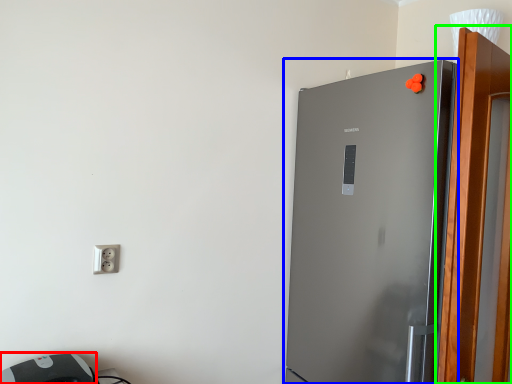
Question: Estimate the real-world distances between objects in this image. Which object is closer to appliance (highlighted by a red box), refrigerator (highlighted by a blue box) or screen door (highlighted by a green box)?

Choices:
 (A) refrigerator
 (B) screen door

Answer: (A)